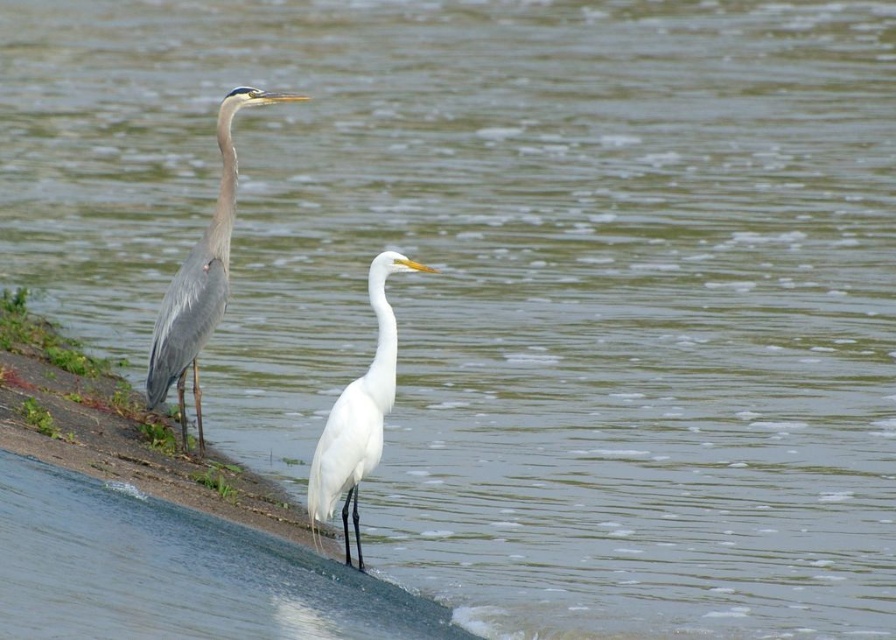
Question: Is gray matte heron at left bigger than white smooth heron at center?

Choices:
 (A) yes
 (B) no

Answer: (A)

Question: Which of the following is the farthest from the observer?

Choices:
 (A) (225, 189)
 (B) (324, 422)

Answer: (B)

Question: Which object is farther from the camera taking this photo?

Choices:
 (A) white smooth heron at center
 (B) gray matte heron at left

Answer: (B)

Question: Is gray matte heron at left to the left of white smooth heron at center from the viewer's perspective?

Choices:
 (A) no
 (B) yes

Answer: (B)

Question: Which of the following is the closest to the observer?

Choices:
 (A) white smooth heron at center
 (B) gray matte heron at left

Answer: (A)

Question: Is gray matte heron at left positioned before white smooth heron at center?

Choices:
 (A) yes
 (B) no

Answer: (B)